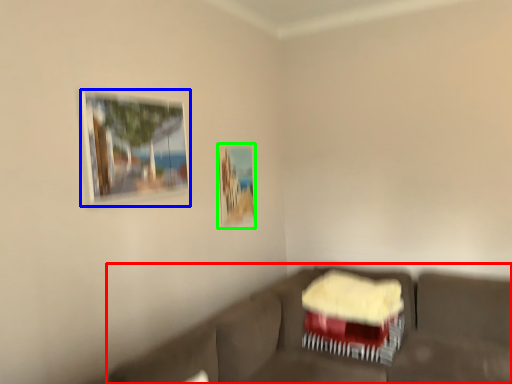
Question: Considering the real-world distances, which object is closest to studio couch (highlighted by a red box)? picture frame (highlighted by a blue box) or picture frame (highlighted by a green box).

Choices:
 (A) picture frame
 (B) picture frame

Answer: (B)